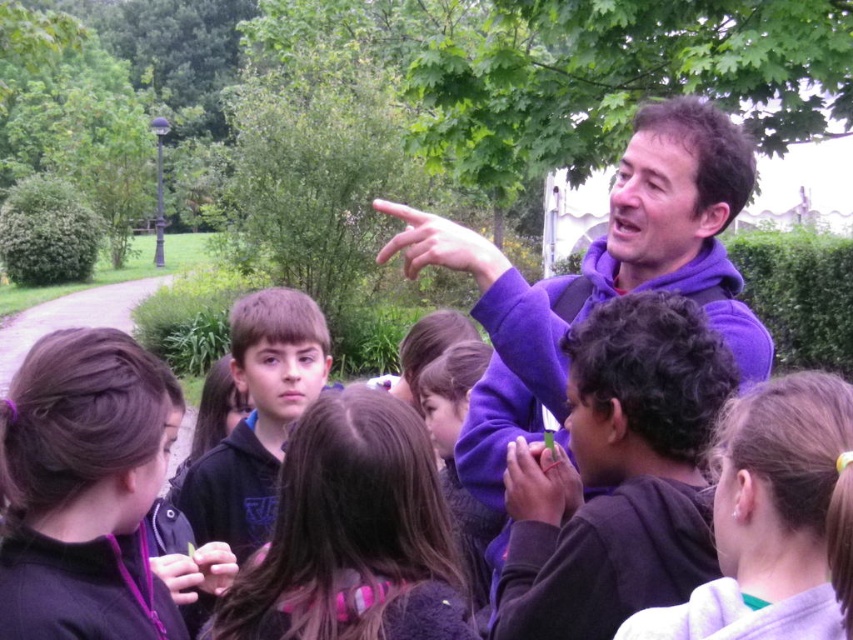
You are a photographer standing at the edge of the park. You want to take a photo of the purple fleece jacket at center and the purple matte hand at center so that both are clearly visible in the frame. Given their distance apart, is it possible to capture both in a single shot without zooming in?

The purple fleece jacket at center and purple matte hand at center are 19.52 inches apart. Since 19.52 inches is a relatively small distance, it is feasible to capture both in a single shot without zooming in, provided the camera is positioned appropriately to include both objects within the frame.

You are a photographer trying to capture the man in the matte purple sweater at center. The park has a rule that you can only take photos within a 100m radius from the entrance located at point 0.000, 0.000. Given that the man is at point 0.900, 0.210, can you legally take his photo according to the park rules?

The man in the matte purple sweater at center is located at point [178,576]. The distance from the entrance at [0,0] to this point is sqrt0.9002 0.2102, which is approximately 0.93 meters. Since this is within the 100m radius, you can legally take his photo according to the park rules.

You are a photographer trying to capture a shot of the matte purple sweater at center and the matte skin hand at lower center. Which object should you focus on first if you want to ensure both are in focus without adjusting the camera settings?

The matte purple sweater at center is above the matte skin hand at lower center. Since the sweater is higher up, focusing on it first would allow the hand to naturally fall into the depth of field, ensuring both are in focus without needing to adjust the camera settings.